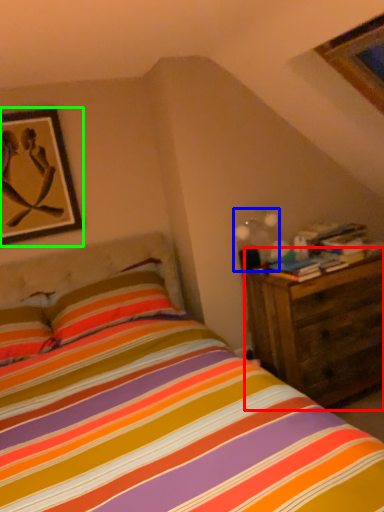
Question: Considering the real-world distances, which object is farthest from nightstand (highlighted by a red box)? light fixture (highlighted by a blue box) or picture frame (highlighted by a green box)?

Choices:
 (A) light fixture
 (B) picture frame

Answer: (B)